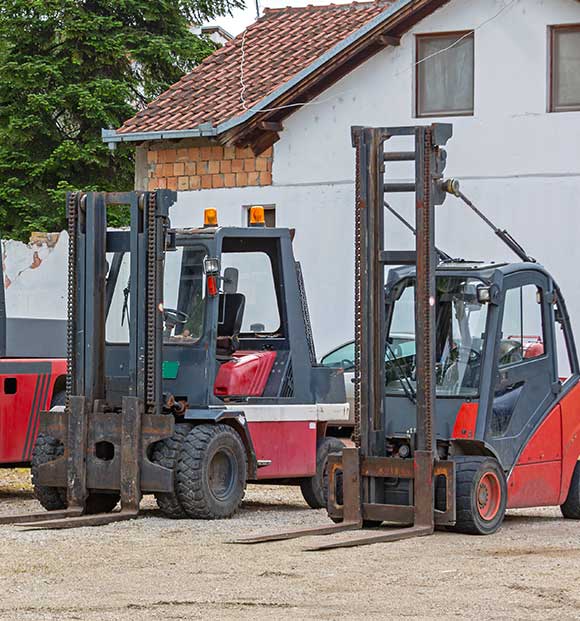
The image size is (580, 621). In order to click on safety lights in this screenshot , I will do click(210, 212), click(255, 212).